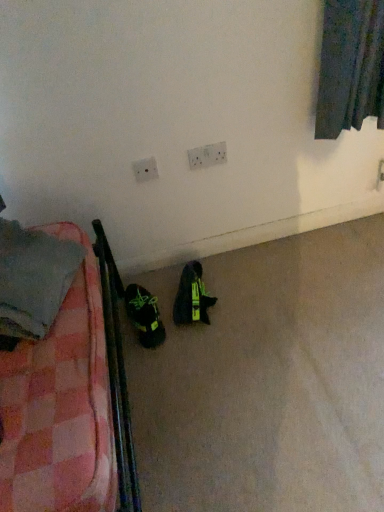
You are a GUI agent. You are given a task and a screenshot of the screen. Output one action in this format:
    pyautogui.click(x=<x>, y=<y>)
    Task: Click on the empty space that is in between green matte sneakers at lower left, arranged as the 2th footwear when viewed from the right, and green synthetic shoe at center, which appears as the second footwear when viewed from the left
    
    Given the screenshot: What is the action you would take?
    pyautogui.click(x=168, y=314)